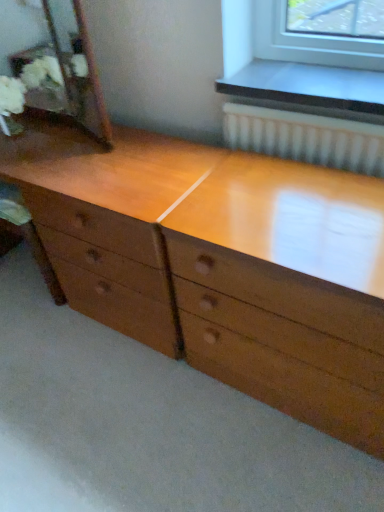
I want to click on free space in front of wooden mirror at left, so [x=64, y=163].